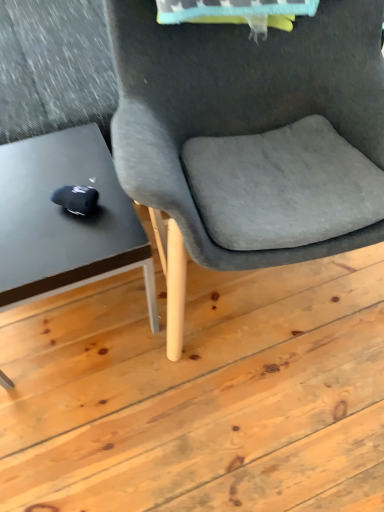
The width and height of the screenshot is (384, 512). What are the coordinates of `empty space that is ontop of matte black table at left` in the screenshot? It's located at (45, 194).